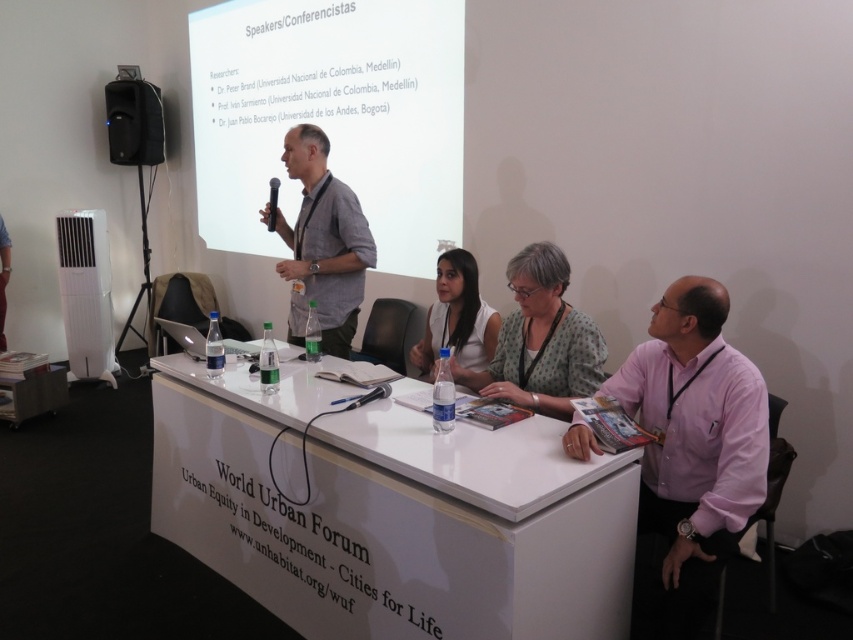
Question: Which object is farther from the camera taking this photo?

Choices:
 (A) white matte projector screen at upper center
 (B) pink cotton shirt at right
 (C) gray fabric shirt at center
 (D) polka dot blouse at center

Answer: (A)

Question: Does white glossy table at center have a greater width compared to black plastic microphone at center?

Choices:
 (A) no
 (B) yes

Answer: (B)

Question: Does white matte projector screen at upper center have a lesser width compared to black plastic microphone at center?

Choices:
 (A) no
 (B) yes

Answer: (A)

Question: Which of the following is the farthest from the observer?

Choices:
 (A) white matte projector screen at upper center
 (B) white matte shirt at center

Answer: (A)

Question: Which is farther from the black plastic microphone at center?

Choices:
 (A) polka dot blouse at center
 (B) black matte speaker at upper left
 (C) white glossy table at center
 (D) gray fabric shirt at center

Answer: (B)

Question: Is pink cotton shirt at right above gray fabric shirt at center?

Choices:
 (A) no
 (B) yes

Answer: (A)